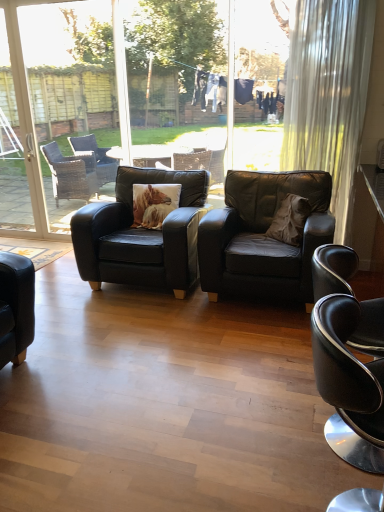
Identify the location of free location in front of matte black armchair at center, placed as the 2th chair when sorted from back to front. (240, 347).